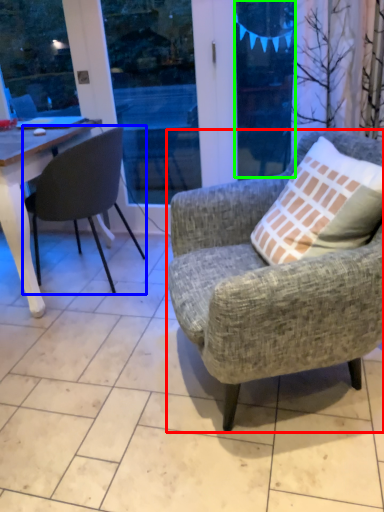
Question: Estimate the real-world distances between objects in this image. Which object is closer to chair (highlighted by a red box), chair (highlighted by a blue box) or window screen (highlighted by a green box)?

Choices:
 (A) chair
 (B) window screen

Answer: (A)